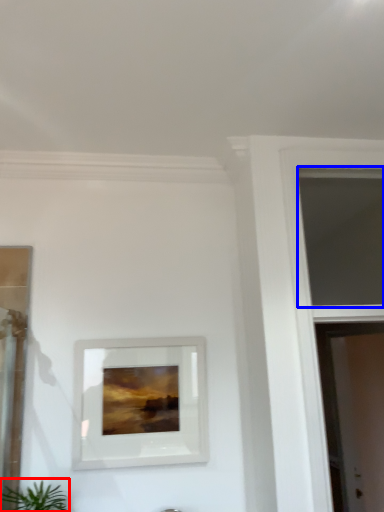
Question: Which object is closer to the camera taking this photo, houseplant (highlighted by a red box) or window (highlighted by a blue box)?

Choices:
 (A) houseplant
 (B) window

Answer: (A)